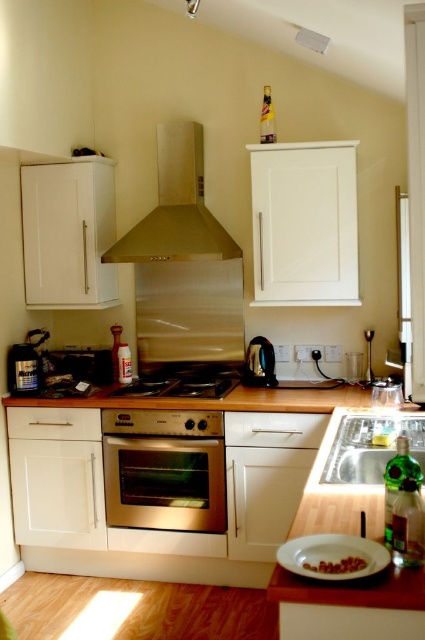
You are a chef preparing to place a hot pan on a surface in the kitchen. You see the stainless steel oven at center and the white wood countertop at center. Which surface is suitable for placing the hot pan?

The white wood countertop at center is suitable for placing the hot pan because the stainless steel oven at center is located below it, indicating the countertop is the upper surface where items are placed.

You are standing in the kitchen and want to wash your hands. Which object should you go to first, the gold metallic exhaust hood at center or the silver metallic sink at lower right?

The silver metallic sink at lower right is behind the gold metallic exhaust hood at center, so you should go to the gold metallic exhaust hood at center first to reach the sink behind it.

You are a kitchen designer planning to install a new appliance. You have a gold metallic exhaust hood at center and a silver metallic sink at lower right in your design. Which of these two objects is bigger in size?

The gold metallic exhaust hood at center has a larger size compared to the silver metallic sink at lower right, so the gold metallic exhaust hood at center is bigger.